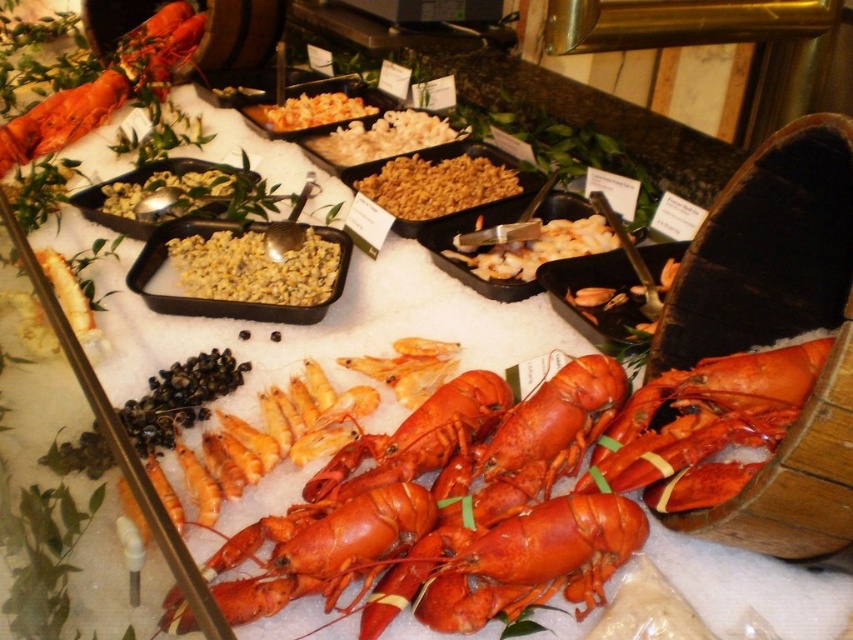
You are a food critic attending a seafood buffet. You notice two items at the center of the display. One is the white glossy shrimp at center and the other is the yellowish matte corn at center. Which of these two items is taller?

The yellowish matte corn at center is taller than the white glossy shrimp at center.

You are standing at the seafood buffet and want to grab a lobster. If you move 2 feet forward from your current position, will you be closer to the point at coordinates point (610, 241)?

The distance of point (610, 241) from camera is 5.03 feet. Moving 2 feet forward would reduce the distance to 3.03 feet, so yes, you would be closer to the point (610, 241).

Where is the white glossy shrimp at center located in the image?

The white glossy shrimp at center is located at point (538, 248).